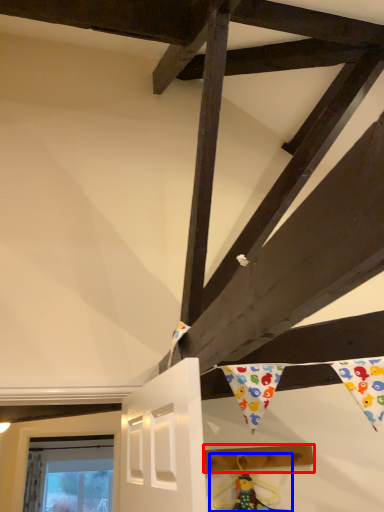
Question: Which object is closer to the camera taking this photo, plank (highlighted by a red box) or doll (highlighted by a blue box)?

Choices:
 (A) plank
 (B) doll

Answer: (B)